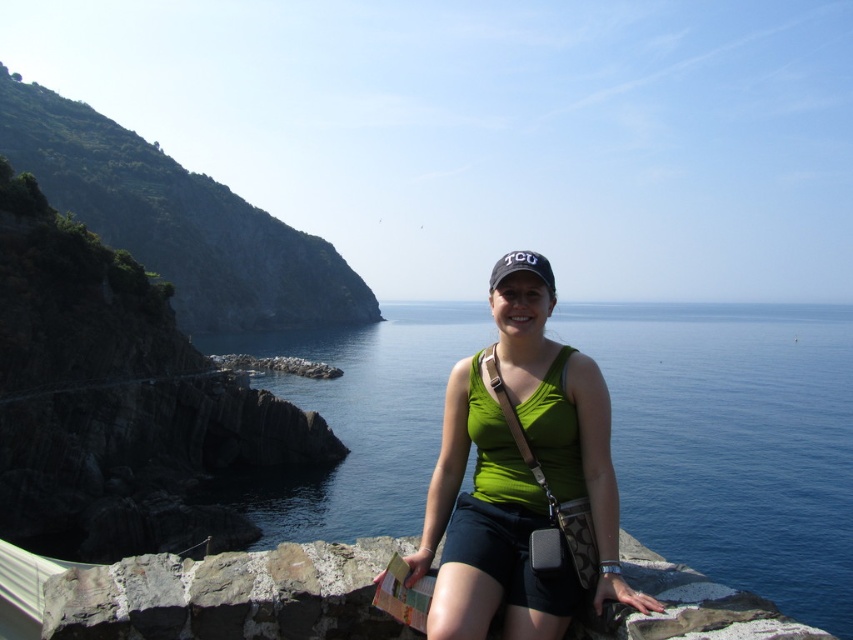
Which is more to the left, green rocky cliff at left or rough textured stone at lower left?

green rocky cliff at left

Does green rocky cliff at left appear over rough textured stone at lower left?

Correct, green rocky cliff at left is located above rough textured stone at lower left.

At what (x,y) coordinates should I click in order to perform the action: click on green rocky cliff at left. Please return your answer as a coordinate pair (x, y). This screenshot has width=853, height=640. Looking at the image, I should click on (177, 220).

Locate an element on the screen. Image resolution: width=853 pixels, height=640 pixels. green rocky cliff at left is located at coordinates pyautogui.click(x=177, y=220).

Between green fabric tank top at center and green rocky cliff at left, which one is positioned higher?

Positioned higher is green rocky cliff at left.

Consider the image. Does green fabric tank top at center lie behind green rocky cliff at left?

No, it is not.

Who is more forward, (505, 410) or (230, 243)?

Point (505, 410) is more forward.

Identify the location of green fabric tank top at center. (521, 477).

Is blue water at center below green fabric tank top at center?

Actually, blue water at center is above green fabric tank top at center.

Describe the element at coordinates (734, 442) in the screenshot. I see `blue water at center` at that location.

Between point (372, 492) and point (492, 307), which one is positioned behind?

The point (372, 492) is more distant.

The image size is (853, 640). In order to click on blue water at center in this screenshot , I will do `click(734, 442)`.